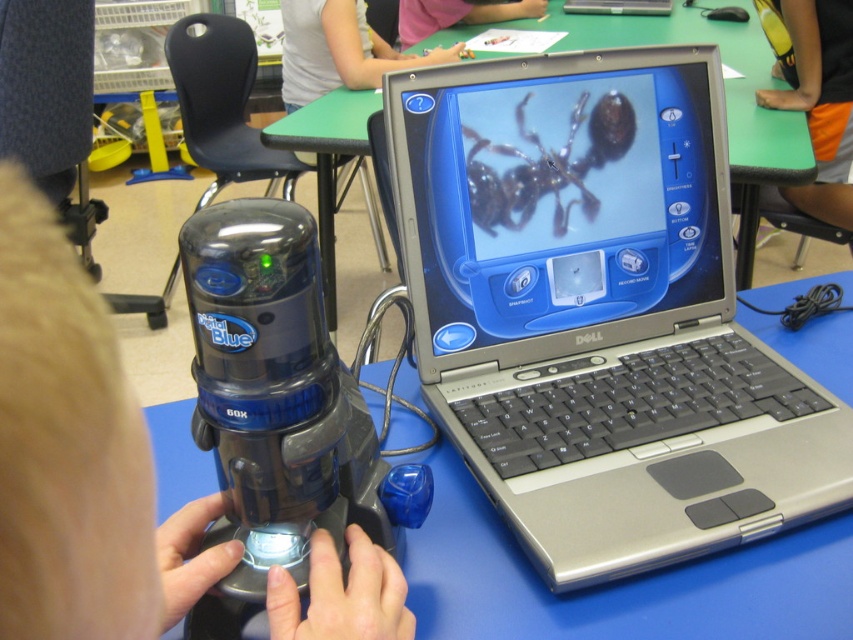
Question: Can you confirm if transparent plastic robot at center is positioned to the right of green plastic table at center?

Choices:
 (A) no
 (B) yes

Answer: (A)

Question: Estimate the real-world distances between objects in this image. Which object is closer to the green plastic table at center?

Choices:
 (A) transparent plastic robot at center
 (B) silver/black plastic laptop at center
 (C) light gray shirt at upper center
 (D) transparent plastic blender at center

Answer: (C)

Question: Which is farther from the shiny black spider at center?

Choices:
 (A) transparent plastic robot at center
 (B) light gray shirt at upper center
 (C) blue plastic table at center
 (D) transparent plastic blender at center

Answer: (B)

Question: Is green plastic table at center bigger than pink fabric shirt at upper center?

Choices:
 (A) yes
 (B) no

Answer: (A)

Question: Among these objects, which one is nearest to the camera?

Choices:
 (A) green plastic table at center
 (B) silver/black plastic laptop at center
 (C) shiny black spider at center
 (D) pink fabric shirt at upper center

Answer: (B)

Question: Can you confirm if silver/black plastic laptop at center is positioned above shiny black spider at center?

Choices:
 (A) no
 (B) yes

Answer: (A)